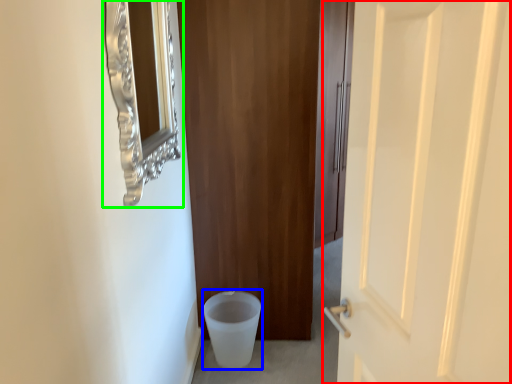
Question: Which object is the farthest from door (highlighted by a red box)? Choose among these: potty (highlighted by a blue box) or medicine cabinet (highlighted by a green box).

Choices:
 (A) potty
 (B) medicine cabinet

Answer: (A)